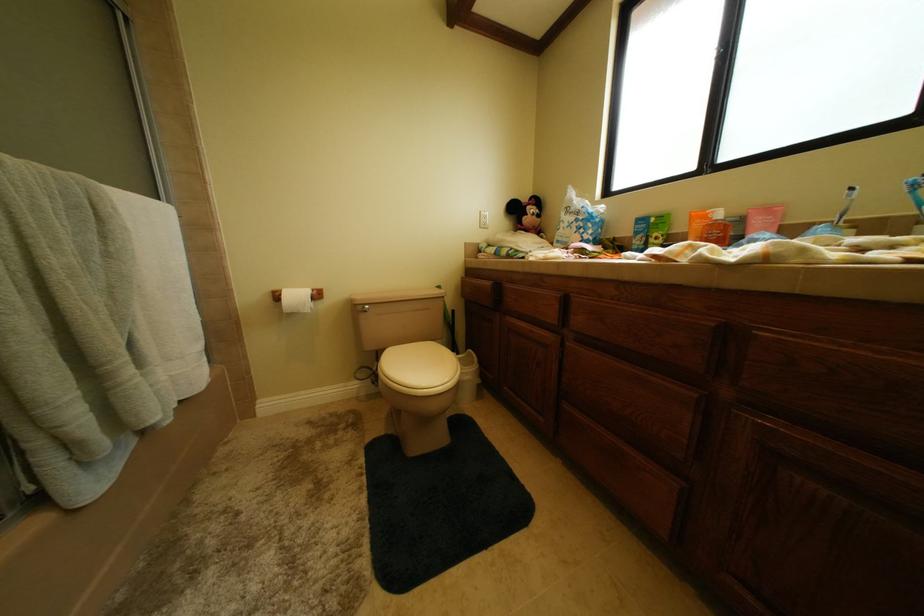
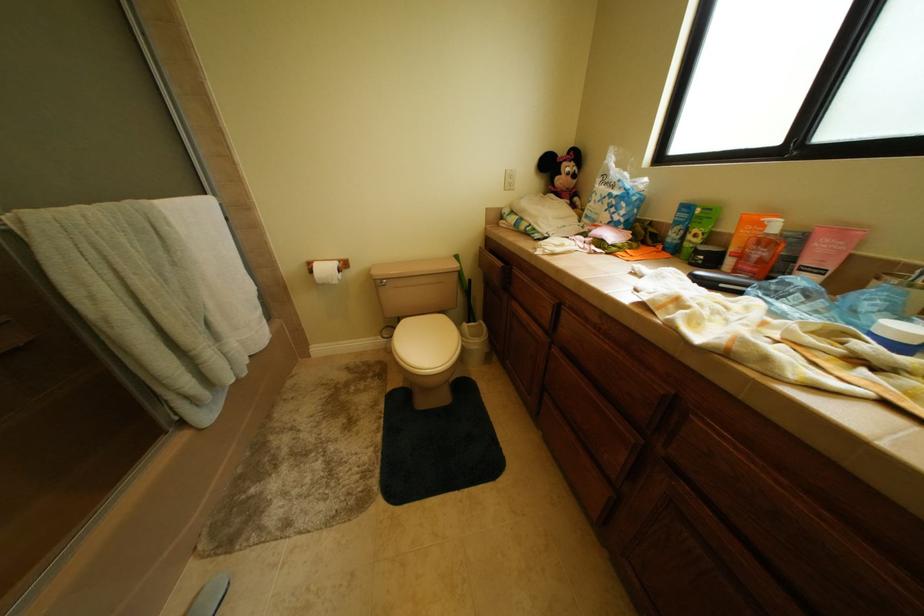
Question: Which direction would the cameraman need to move to produce the second image? Reply with the corresponding letter.

Choices:
 (A) Left
 (B) Right
 (C) Forward
 (D) Backward

Answer: (B)